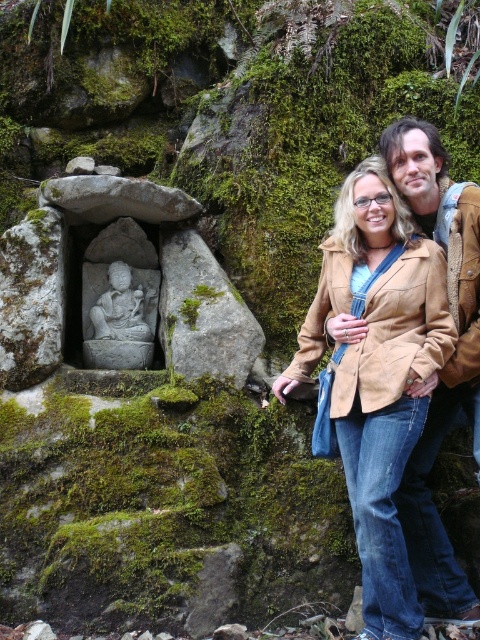
You are a photographer trying to capture both the matte brown leather jacket at center and the brown leather jacket at right in a single shot. Since you want to include the stone structure in the background, which jacket should you position closer to the camera to ensure both are in focus?

The matte brown leather jacket at center is to the left of brown leather jacket at right, so positioning the brown leather jacket at right closer to the camera would keep both jackets and the stone structure in focus.

You are a photographer trying to capture both the matte brown leather jacket at center and the brown leather jacket at right in a single frame. Based on their sizes, which jacket will appear larger in the photo?

The matte brown leather jacket at center will appear larger in the photo because it is taller than the brown leather jacket at right.